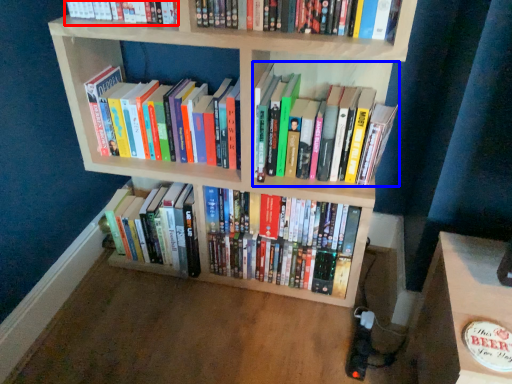
Question: Which object is further to the camera taking this photo, book (highlighted by a red box) or book (highlighted by a blue box)?

Choices:
 (A) book
 (B) book

Answer: (B)